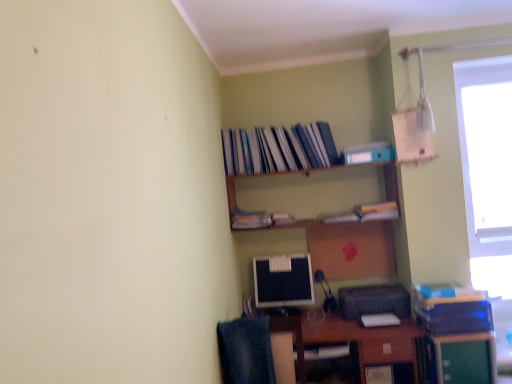
Question: In terms of height, does brown wooden desk at lower center look taller or shorter compared to wooden shelf at upper center?

Choices:
 (A) short
 (B) tall

Answer: (B)

Question: From the image's perspective, is brown wooden desk at lower center positioned above or below wooden shelf at upper center?

Choices:
 (A) below
 (B) above

Answer: (A)

Question: Which is nearer to the black plastic printer at lower right?

Choices:
 (A) transparent glass window at upper right
 (B) hardcover book at upper center, positioned as the third book in top-to-bottom order
 (C) green plastic file cabinet at lower right, arranged as the 1th file cabinet when viewed from the top
 (D) wooden shelf at upper center
 (E) matte black monitor at center

Answer: (C)

Question: Which is nearer to the matte black monitor at center?

Choices:
 (A) denim at lower left
 (B) green matte file cabinet at lower right, marked as the 2th file cabinet in a top-to-bottom arrangement
 (C) green plastic file cabinet at lower right, the second file cabinet positioned from the bottom
 (D) light blue matte paperback book at upper center, the 2th paperback book in the front-to-back sequence
 (E) black plastic printer at lower right

Answer: (E)